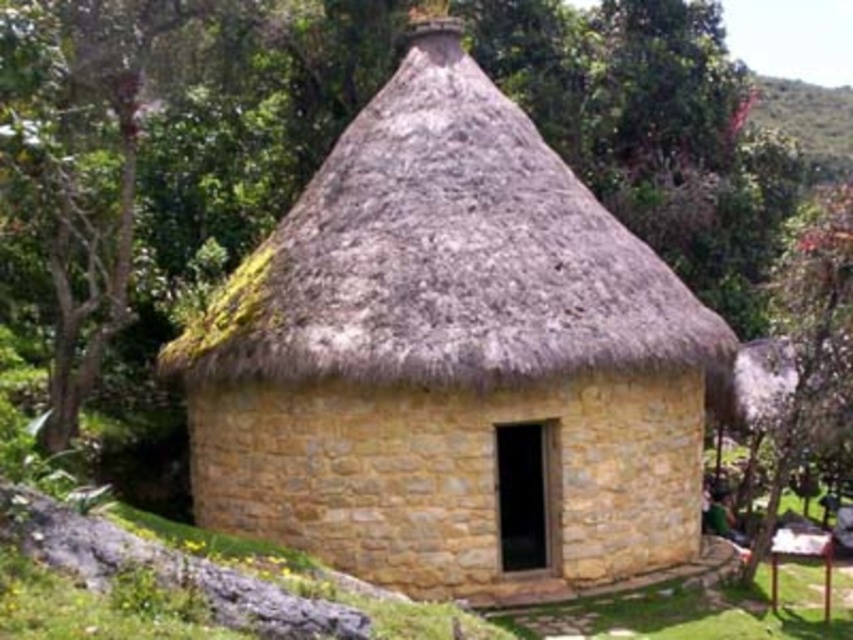
Does yellow stone hut at center appear under green leafy tree at upper right?

Yes, yellow stone hut at center is below green leafy tree at upper right.

Can you confirm if yellow stone hut at center is positioned to the left of green leafy tree at upper right?

Indeed, yellow stone hut at center is positioned on the left side of green leafy tree at upper right.

Is point (376, 531) in front of point (822, 284)?

Yes, point (376, 531) is in front of point (822, 284).

You are a GUI agent. You are given a task and a screenshot of the screen. Output one action in this format:
    pyautogui.click(x=<x>, y=<y>)
    Task: Click on the yellow stone hut at center
    The image size is (853, 640).
    Given the screenshot: What is the action you would take?
    pyautogui.click(x=453, y=358)